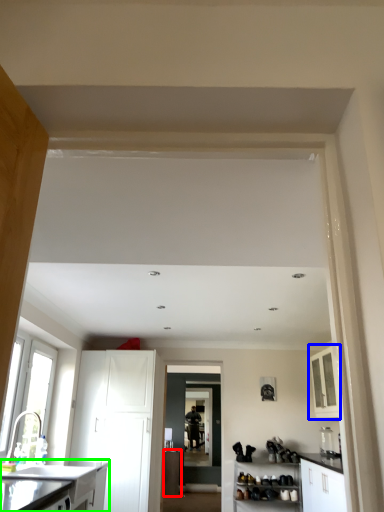
Question: Which is farther away from cabinetry (highlighted by a red box)? cabinetry (highlighted by a blue box) or cabinetry (highlighted by a green box)?

Choices:
 (A) cabinetry
 (B) cabinetry

Answer: (B)